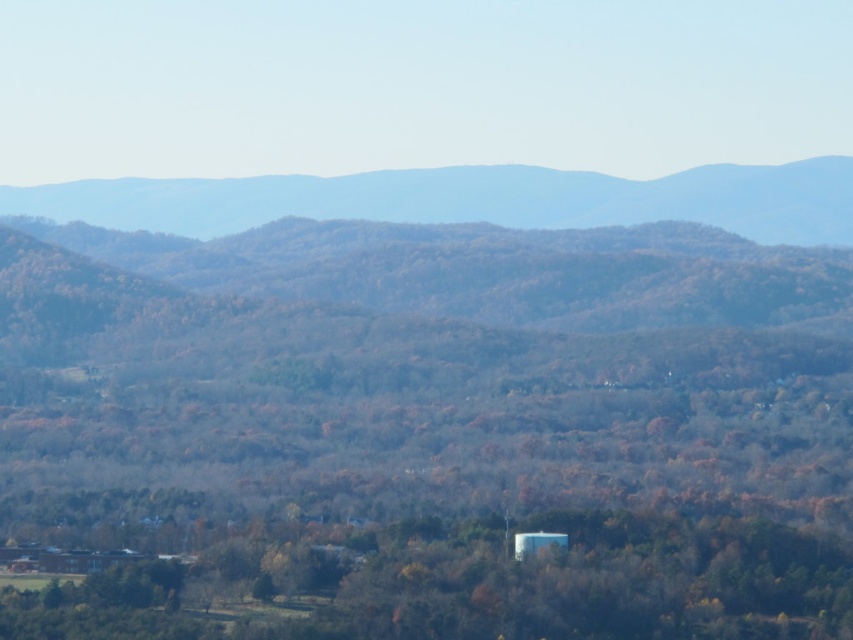
You are standing in the dense forest of the hilly landscape shown. You see a point marked at coordinates (579,582). What object is located at that point?

The point at coordinates (579,582) marks the green matte tree at center.

You are standing in the dense forest of the hilly landscape. You see a green matte tree at center. Based on its 2D coordinates, where is the green matte tree located in the image?

The green matte tree at center is located at the 2D coordinates point (x=579, y=582) in the image.